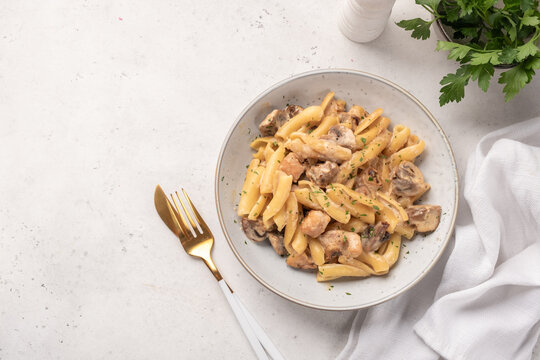
Locate an element on the screen. wrinkly cloth napkin is located at coordinates (496, 254).